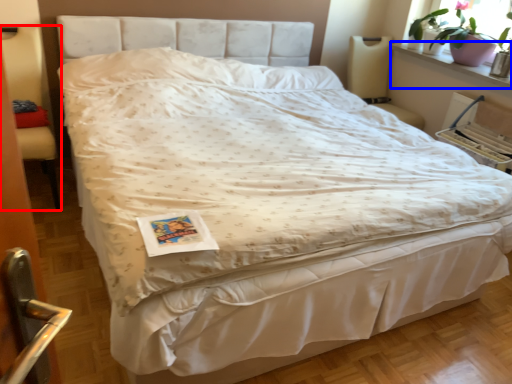
Question: Among these objects, which one is farthest to the camera, armchair (highlighted by a red box) or window sill (highlighted by a blue box)?

Choices:
 (A) armchair
 (B) window sill

Answer: (B)